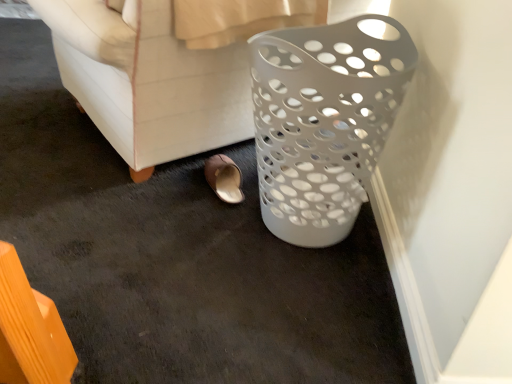
Question: Is white plastic laundry basket at right turned away from brown leather slipper at lower center?

Choices:
 (A) no
 (B) yes

Answer: (B)

Question: Is white plastic laundry basket at right shorter than brown leather slipper at lower center?

Choices:
 (A) no
 (B) yes

Answer: (A)

Question: Is white plastic laundry basket at right taller than brown leather slipper at lower center?

Choices:
 (A) yes
 (B) no

Answer: (A)

Question: Is white plastic laundry basket at right positioned in front of brown leather slipper at lower center?

Choices:
 (A) no
 (B) yes

Answer: (B)

Question: Is white plastic laundry basket at right facing towards brown leather slipper at lower center?

Choices:
 (A) no
 (B) yes

Answer: (A)

Question: From the image's perspective, is white plastic laundry basket at right located beneath brown leather slipper at lower center?

Choices:
 (A) no
 (B) yes

Answer: (A)

Question: Can you confirm if brown leather slipper at lower center is thinner than white plastic laundry basket at right?

Choices:
 (A) no
 (B) yes

Answer: (B)

Question: Considering the relative positions of brown leather slipper at lower center and white plastic laundry basket at right in the image provided, is brown leather slipper at lower center behind white plastic laundry basket at right?

Choices:
 (A) no
 (B) yes

Answer: (B)

Question: Can you confirm if brown leather slipper at lower center is wider than white plastic laundry basket at right?

Choices:
 (A) no
 (B) yes

Answer: (A)

Question: Is brown leather slipper at lower center facing away from white plastic laundry basket at right?

Choices:
 (A) yes
 (B) no

Answer: (A)

Question: Is white plastic laundry basket at right a part of brown leather slipper at lower center?

Choices:
 (A) no
 (B) yes

Answer: (A)

Question: Does brown leather slipper at lower center have a larger size compared to white plastic laundry basket at right?

Choices:
 (A) yes
 (B) no

Answer: (B)

Question: From the image's perspective, does white plastic basket at right appear lower than white plastic laundry basket at right?

Choices:
 (A) yes
 (B) no

Answer: (A)